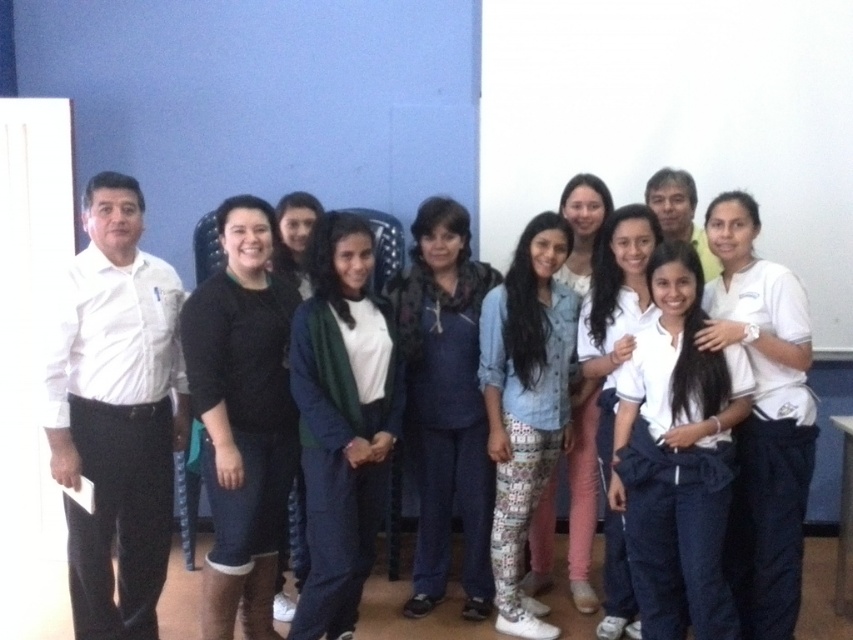
Locate an element on the screen. dark blue tracksuit at center is located at coordinates (341, 420).

Does dark blue tracksuit at center have a lesser height compared to dark blue denim pants at center?

Correct, dark blue tracksuit at center is not as tall as dark blue denim pants at center.

Where is `dark blue tracksuit at center`? The height and width of the screenshot is (640, 853). dark blue tracksuit at center is located at coordinates (341, 420).

Based on the photo, is black matte sweater at center wider than dark blue tracksuit at center?

No.

Which of these two, black matte sweater at center or dark blue tracksuit at center, stands shorter?

dark blue tracksuit at center

Which is in front, point (276, 296) or point (326, 394)?

Point (326, 394) is in front.

Where is `black matte sweater at center`? The width and height of the screenshot is (853, 640). black matte sweater at center is located at coordinates (242, 416).

Is black matte sweater at center in front of dark blue denim pants at center?

Yes, it is in front of dark blue denim pants at center.

Which is below, black matte sweater at center or dark blue denim pants at center?

Positioned lower is black matte sweater at center.

Who is more forward, (216, 620) or (444, 573)?

Point (216, 620) is in front.

Locate an element on the screen. The image size is (853, 640). black matte sweater at center is located at coordinates (242, 416).